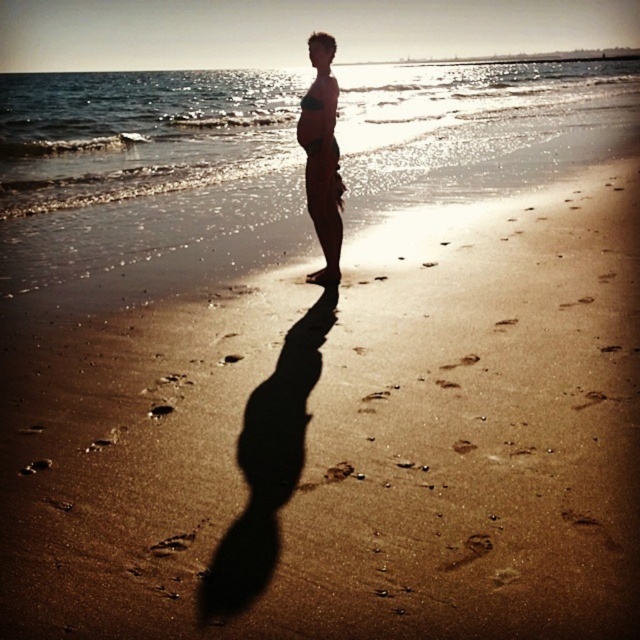
The image size is (640, 640). Identify the location of translucent water at upper center. (140, 132).

Does translucent water at upper center have a larger size compared to matte skin at center?

Yes.

Is point (355, 100) less distant than point (323, 236)?

No, (355, 100) is further to viewer.

Identify the location of translucent water at upper center. (140, 132).